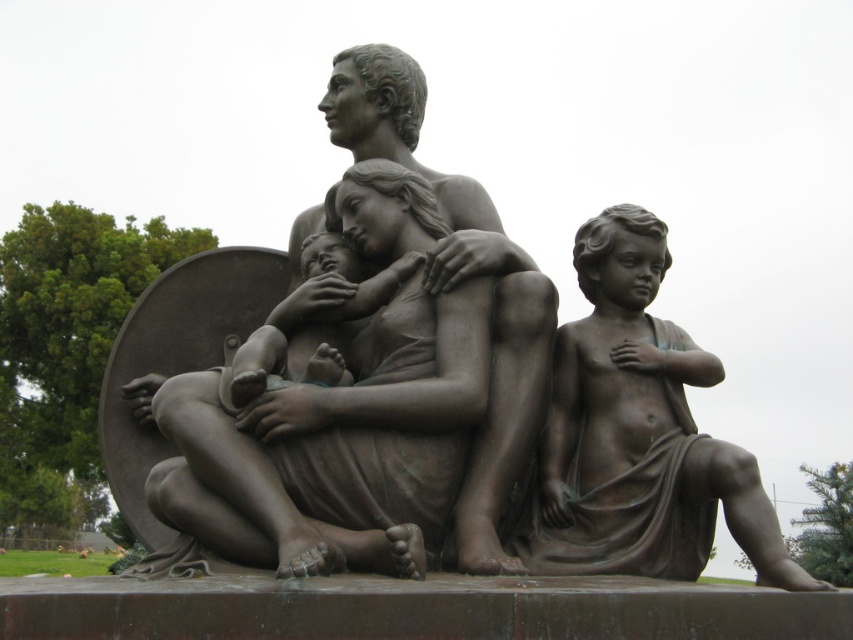
You are an art curator planning to display the bronze sculpture at center and the bronze statue of child at right in a gallery. Given their sizes, which one should be placed in a more prominent location to highlight its significance?

The bronze sculpture at center should be placed in a more prominent location because it has a larger size compared to the bronze statue of child at right, making it visually dominant and suitable for emphasis.

You are standing in front of a bronze family sculpture. There is a point at coordinates point [430,497]. Can you reach this point with your outstretched hand?

The point [430,497] is 36.09 meters away from you, so you cannot reach it with your outstretched hand.